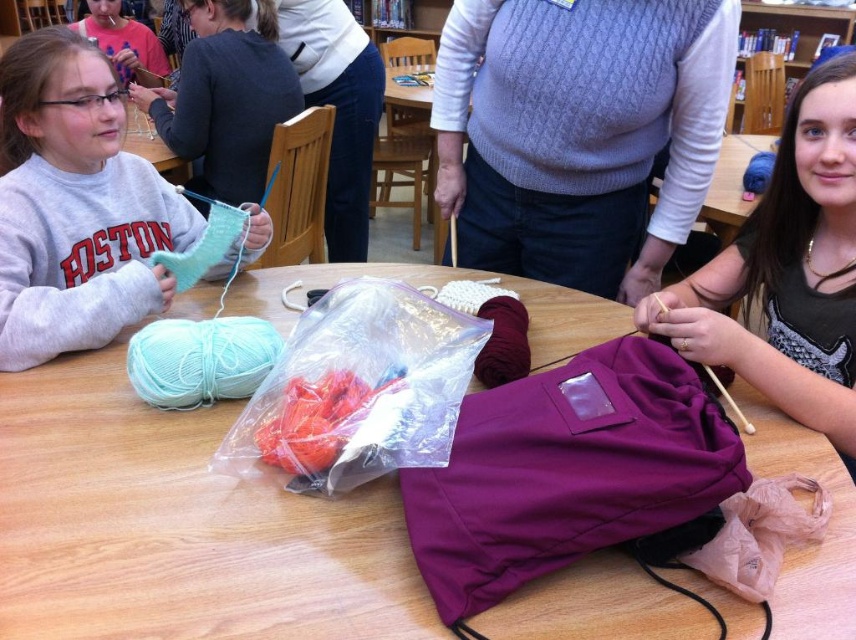
Who is shorter, gray cotton sweatshirt at left or purple fabric at center?

With less height is gray cotton sweatshirt at left.

In the scene shown: Does gray cotton sweatshirt at left appear on the left side of purple fabric at center?

Yes, gray cotton sweatshirt at left is to the left of purple fabric at center.

Find the location of a particular element. The width and height of the screenshot is (856, 640). gray cotton sweatshirt at left is located at coordinates (75, 205).

Image resolution: width=856 pixels, height=640 pixels. Identify the location of gray cotton sweatshirt at left. (75, 205).

Identify the location of gray cotton sweatshirt at left. Image resolution: width=856 pixels, height=640 pixels. (75, 205).

Can you confirm if gray cotton sweatshirt at left is positioned to the left of matte pink sweater at upper left?

Incorrect, gray cotton sweatshirt at left is not on the left side of matte pink sweater at upper left.

Identify the location of gray cotton sweatshirt at left. The height and width of the screenshot is (640, 856). (75, 205).

Who is lower down, wooden table at center or matte pink sweater at upper left?

Positioned lower is wooden table at center.

Does wooden table at center appear on the right side of matte pink sweater at upper left?

Indeed, wooden table at center is positioned on the right side of matte pink sweater at upper left.

This screenshot has width=856, height=640. I want to click on wooden table at center, so click(177, 528).

Where is `wooden table at center`? This screenshot has width=856, height=640. wooden table at center is located at coordinates (177, 528).